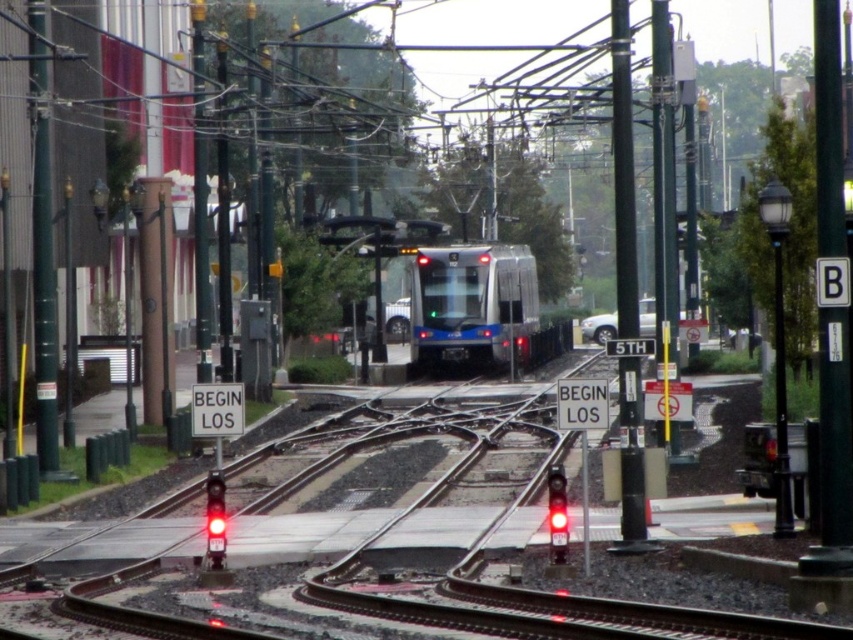
Does black metal pole at center right have a greater width compared to red glass traffic light at lower left?

Indeed, black metal pole at center right has a greater width compared to red glass traffic light at lower left.

I want to click on black metal pole at center right, so click(x=624, y=173).

The width and height of the screenshot is (853, 640). I want to click on black metal pole at center right, so click(624, 173).

Is metallic pole at right thinner than red glass traffic light at center?

Incorrect, metallic pole at right's width is not less than red glass traffic light at center's.

In the scene shown: Who is higher up, metallic pole at right or red glass traffic light at center?

metallic pole at right is higher up.

Locate an element on the screen. metallic pole at right is located at coordinates (663, 179).

Does black metal pole at center right have a smaller size compared to red glass traffic light at center?

No.

Between black metal pole at center right and red glass traffic light at center, which one appears on the left side from the viewer's perspective?

red glass traffic light at center is more to the left.

Identify the location of black metal pole at center right. The height and width of the screenshot is (640, 853). (624, 173).